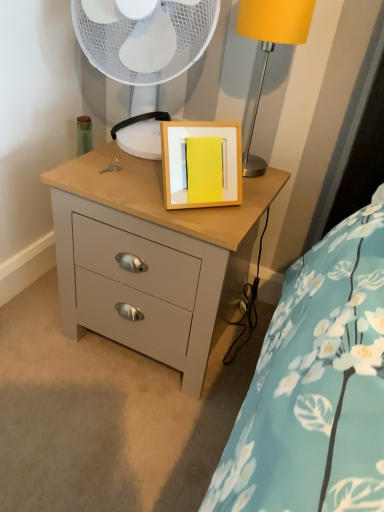
The image size is (384, 512). In order to click on matte yellow lampshade at upper right in this screenshot , I will do `click(270, 48)`.

Which of these two, matte yellow lampshade at upper right or matte gray chest of drawers at center, is wider?

matte gray chest of drawers at center is wider.

Is matte gray chest of drawers at center inside matte yellow lampshade at upper right?

Actually, matte gray chest of drawers at center is outside matte yellow lampshade at upper right.

Between matte yellow lampshade at upper right and matte gray chest of drawers at center, which one has more height?

matte gray chest of drawers at center.

From the image's perspective, between matte yellow lampshade at upper right and matte gray chest of drawers at center, which one is located above?

matte yellow lampshade at upper right, from the image's perspective.

Considering the sizes of objects matte yellow lampshade at upper right and white plastic fan at upper center in the image provided, who is shorter, matte yellow lampshade at upper right or white plastic fan at upper center?

With less height is white plastic fan at upper center.

From the image's perspective, relative to white plastic fan at upper center, is matte yellow lampshade at upper right above or below?

Clearly, from the image's perspective, matte yellow lampshade at upper right is below white plastic fan at upper center.

Is point (298, 37) closer to camera compared to point (163, 31)?

Yes, it is.

What's the angular difference between matte yellow lampshade at upper right and white plastic fan at upper center's facing directions?

The facing directions of matte yellow lampshade at upper right and white plastic fan at upper center are 1.65 degrees apart.

Is matte gray chest of drawers at center positioned with its back to matte yellow lampshade at upper right?

No, matte gray chest of drawers at center's orientation is not away from matte yellow lampshade at upper right.

From the picture: How many degrees apart are the facing directions of matte gray chest of drawers at center and matte yellow lampshade at upper right?

matte gray chest of drawers at center and matte yellow lampshade at upper right are facing 2.07 degrees away from each other.

How much distance is there between matte gray chest of drawers at center and matte yellow lampshade at upper right?

matte gray chest of drawers at center is 14.81 inches from matte yellow lampshade at upper right.

Who is taller, matte gray chest of drawers at center or matte yellow lampshade at upper right?

matte gray chest of drawers at center.

Considering the sizes of objects white plastic fan at upper center and matte gray chest of drawers at center in the image provided, who is shorter, white plastic fan at upper center or matte gray chest of drawers at center?

white plastic fan at upper center.

Is point (172, 16) farther from camera compared to point (101, 184)?

No, it is in front of (101, 184).

From a real-world perspective, is white plastic fan at upper center positioned over matte gray chest of drawers at center based on gravity?

Yes.

In terms of height, does white plastic fan at upper center look taller or shorter compared to matte yellow lampshade at upper right?

Clearly, white plastic fan at upper center is shorter compared to matte yellow lampshade at upper right.

Do you think white plastic fan at upper center is within matte yellow lampshade at upper right, or outside of it?

white plastic fan at upper center is not enclosed by matte yellow lampshade at upper right.

How different are the orientations of white plastic fan at upper center and matte yellow lampshade at upper right in degrees?

There is a 1.65-degree angle between the facing directions of white plastic fan at upper center and matte yellow lampshade at upper right.

Would you consider white plastic fan at upper center to be distant from matte yellow lampshade at upper right?

No.

Locate an element on the screen. This screenshot has height=512, width=384. mechanical fan lying above the matte gray chest of drawers at center (from the image's perspective) is located at coordinates (144, 51).

Consider the image. Can you tell me how much matte gray chest of drawers at center and white plastic fan at upper center differ in facing direction?

The angle between the facing direction of matte gray chest of drawers at center and the facing direction of white plastic fan at upper center is 3.73 degrees.

Is matte gray chest of drawers at center not near white plastic fan at upper center?

That's not correct — matte gray chest of drawers at center is a little close to white plastic fan at upper center.

Is matte gray chest of drawers at center turned away from white plastic fan at upper center?

matte gray chest of drawers at center is not turned away from white plastic fan at upper center.

Locate an element on the screen. the chest of drawers lying in front of the matte yellow lampshade at upper right is located at coordinates (146, 257).

The width and height of the screenshot is (384, 512). Find the location of `mechanical fan behind the matte yellow lampshade at upper right`. mechanical fan behind the matte yellow lampshade at upper right is located at coordinates (144, 51).

In the scene shown: Looking at the image, which one is located closer to matte gray chest of drawers at center, matte yellow lampshade at upper right or white plastic fan at upper center?

white plastic fan at upper center is positioned closer to the anchor matte gray chest of drawers at center.

Looking at the image, which one is located further to white plastic fan at upper center, matte gray chest of drawers at center or matte yellow lampshade at upper right?

Among the two, matte gray chest of drawers at center is located further to white plastic fan at upper center.

Based on their spatial positions, is white plastic fan at upper center or matte yellow lampshade at upper right further from matte gray chest of drawers at center?

matte yellow lampshade at upper right lies further to matte gray chest of drawers at center than the other object.

From the picture: When comparing their distances from white plastic fan at upper center, does matte yellow lampshade at upper right or matte gray chest of drawers at center seem further?

matte gray chest of drawers at center lies further to white plastic fan at upper center than the other object.

Looking at this image, considering their positions, is matte gray chest of drawers at center positioned further to matte yellow lampshade at upper right than white plastic fan at upper center?

matte gray chest of drawers at center.

Looking at the image, which one is located further to matte yellow lampshade at upper right, white plastic fan at upper center or matte gray chest of drawers at center?

matte gray chest of drawers at center.

Identify the location of table lamp between white plastic fan at upper center and matte gray chest of drawers at center vertically. Image resolution: width=384 pixels, height=512 pixels. (270, 48).